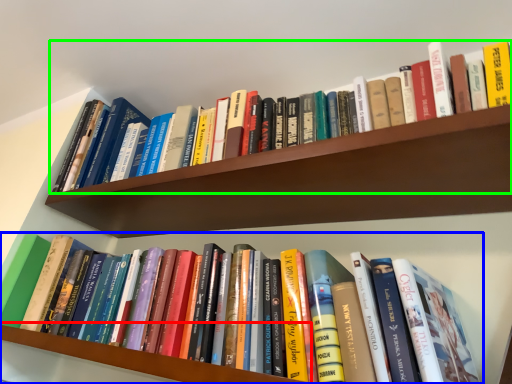
Question: Which object is the closest to the shelf (highlighted by a red box)? Choose among these: book (highlighted by a blue box) or book (highlighted by a green box).

Choices:
 (A) book
 (B) book

Answer: (A)